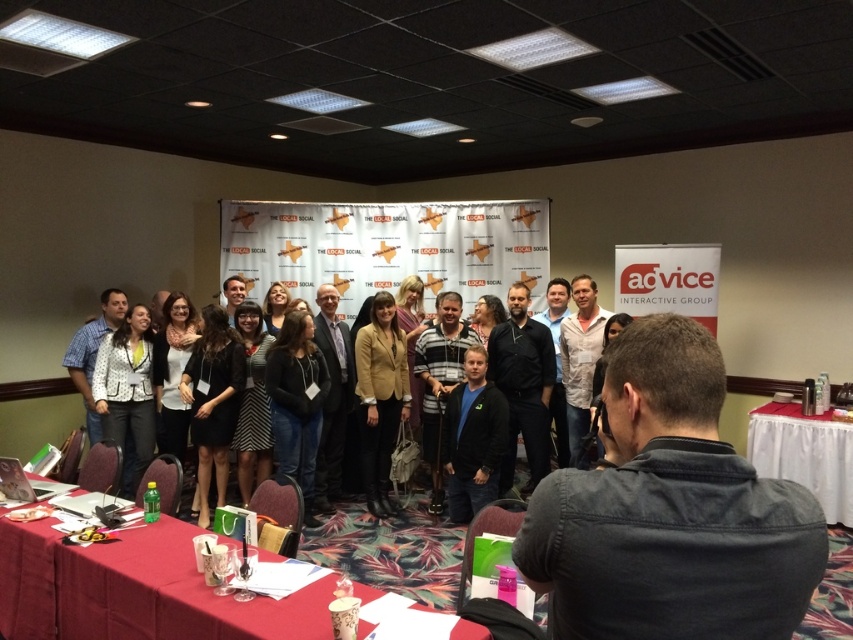
Question: Based on their relative distances, which object is farther from the white dotted blazer at center?

Choices:
 (A) dark blue shirt at center
 (B) dark gray denim jacket at center
 (C) smooth red tablecloth at lower left
 (D) white cloth-covered table at lower right

Answer: (D)

Question: Can you confirm if smooth red tablecloth at lower left is wider than dark blue shirt at center?

Choices:
 (A) no
 (B) yes

Answer: (B)

Question: Which object is farther from the camera taking this photo?

Choices:
 (A) white cloth-covered table at lower right
 (B) dark gray denim jacket at center

Answer: (A)

Question: Is the position of white cloth-covered table at lower right more distant than that of white dotted blazer at center?

Choices:
 (A) yes
 (B) no

Answer: (B)

Question: Which of the following is the farthest from the observer?

Choices:
 (A) white cloth-covered table at lower right
 (B) matte gold blazer at center

Answer: (B)

Question: Does dark blue shirt at center have a smaller size compared to matte gold blazer at center?

Choices:
 (A) no
 (B) yes

Answer: (A)